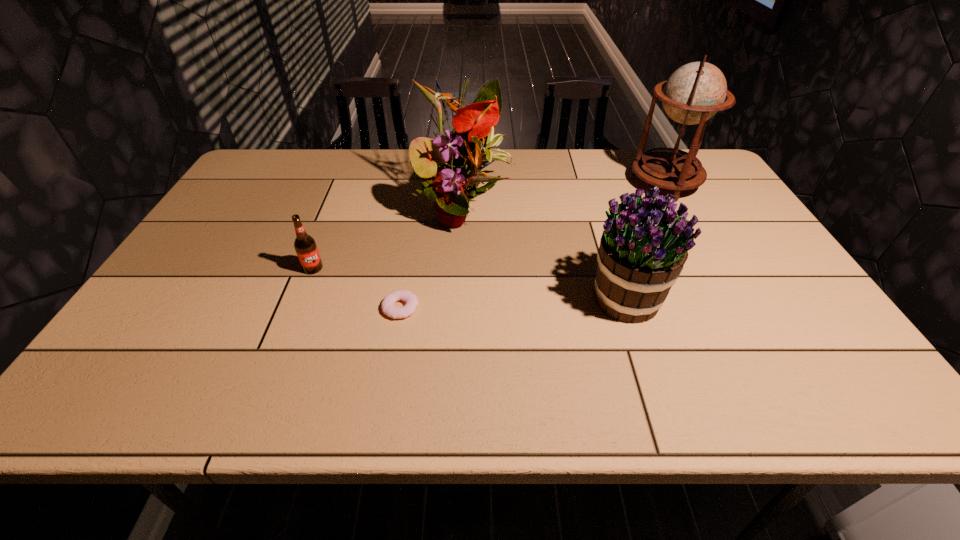
At what (x,y) coordinates should I click in order to perform the action: click on object that stands as the second closest to the left bouquet. Please return your answer as a coordinate pair (x, y). Looking at the image, I should click on tap(643, 248).

Select which object is the closest to the globe. Please provide its 2D coordinates. Your answer should be formatted as a tuple, i.e. [(x, y)], where the tuple contains the x and y coordinates of a point satisfying the conditions above.

[(643, 248)]

Image resolution: width=960 pixels, height=540 pixels. I want to click on vacant space that satisfies the following two spatial constraints: 1. on the surface of the rightmost object; 2. on the front-facing side of the taller bouquet, so click(x=681, y=212).

Identify the location of vacant area that satisfies the following two spatial constraints: 1. on the surface of the globe; 2. on the front-facing side of the taller bouquet. (681, 212).

The height and width of the screenshot is (540, 960). Identify the location of blank area in the image that satisfies the following two spatial constraints: 1. on the back side of the third tallest object; 2. on the right side of the shortest object. (402, 299).

I want to click on free spot that satisfies the following two spatial constraints: 1. on the surface of the globe; 2. on the front side of the leftmost object, so click(711, 268).